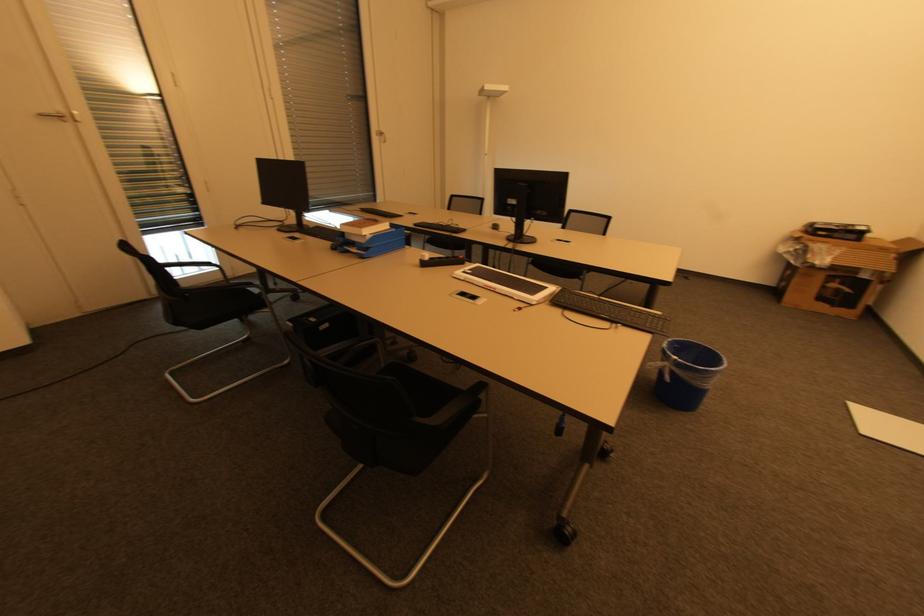
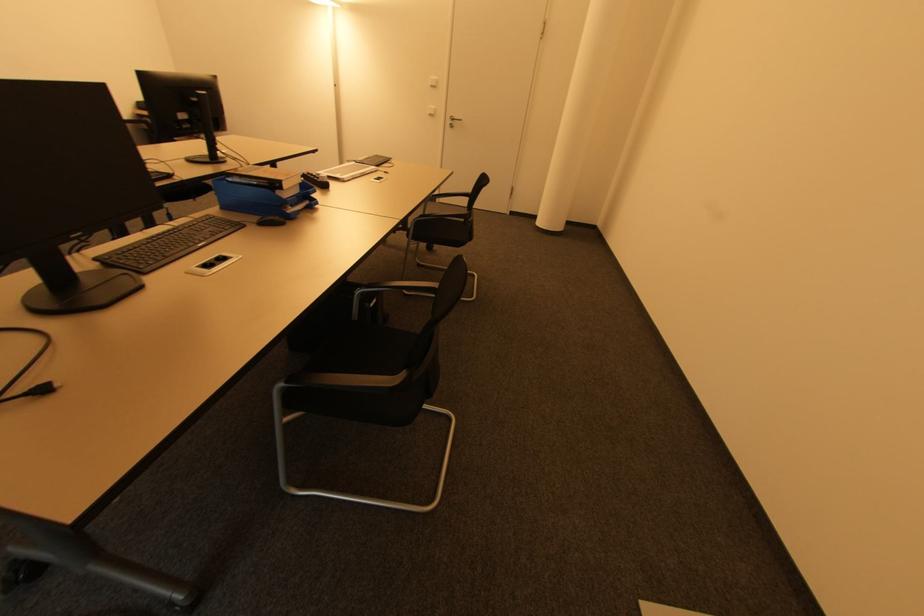
Where in the second image is the point corresponding to (359,249) from the first image?

(294, 207)